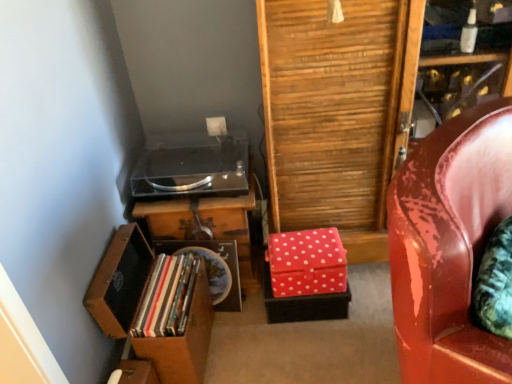
At what (x,y) coordinates should I click in order to perform the action: click on glossy leather chair at right. Please return your answer as a coordinate pair (x, y). Looking at the image, I should click on (449, 246).

Locate an element on the screen. This screenshot has height=384, width=512. wooden table at center is located at coordinates (208, 226).

In order to face transparent acrylic stereo at center, should I rotate leftwards or rightwards?

You should look left and rotate roughly 8.108 degrees.

What is the approximate height of transparent acrylic stereo at center?

It is 4.45 inches.

Locate an element on the screen. This screenshot has width=512, height=384. wooden chest of drawers at lower left is located at coordinates (119, 281).

Identify the location of red polka dot fabric box at lower right. (307, 262).

What are the coordinates of `matte plastic books at lower left` in the screenshot? It's located at (167, 297).

The height and width of the screenshot is (384, 512). In order to click on glossy leather chair at right in this screenshot , I will do `click(449, 246)`.

Would you say wooden chest of drawers at lower left is inside or outside glossy leather chair at right?

wooden chest of drawers at lower left exists outside the volume of glossy leather chair at right.

Is wooden chest of drawers at lower left thinner than glossy leather chair at right?

Indeed, wooden chest of drawers at lower left has a lesser width compared to glossy leather chair at right.

Considering the points (138, 296) and (502, 117), which point is behind, point (138, 296) or point (502, 117)?

The point (138, 296) is farther.

Can you confirm if wooden chest of drawers at lower left is bigger than glossy leather chair at right?

Incorrect, wooden chest of drawers at lower left is not larger than glossy leather chair at right.

Is matte plastic books at lower left smaller than red polka dot fabric box at lower right?

Indeed, matte plastic books at lower left has a smaller size compared to red polka dot fabric box at lower right.

Is red polka dot fabric box at lower right a part of matte plastic books at lower left?

Actually, red polka dot fabric box at lower right is outside matte plastic books at lower left.

From a real-world perspective, is matte plastic books at lower left on top of red polka dot fabric box at lower right?

Yes, from a real-world perspective, matte plastic books at lower left is above red polka dot fabric box at lower right.

Based on the photo, does matte plastic books at lower left have a greater width compared to red polka dot fabric box at lower right?

Incorrect, the width of matte plastic books at lower left does not surpass that of red polka dot fabric box at lower right.

Is transparent acrylic stereo at center bigger than wooden chest of drawers at lower left?

Actually, transparent acrylic stereo at center might be smaller than wooden chest of drawers at lower left.

Between transparent acrylic stereo at center and wooden chest of drawers at lower left, which one has more height?

Standing taller between the two is wooden chest of drawers at lower left.

Is transparent acrylic stereo at center not near wooden chest of drawers at lower left?

No.

Can you tell me how much transparent acrylic stereo at center and wooden chest of drawers at lower left differ in facing direction?

They differ by 91.6 degrees in their facing directions.

Considering the relative sizes of red polka dot fabric box at lower right and glossy leather chair at right in the image provided, is red polka dot fabric box at lower right taller than glossy leather chair at right?

No, red polka dot fabric box at lower right is not taller than glossy leather chair at right.

Is red polka dot fabric box at lower right positioned beyond the bounds of glossy leather chair at right?

That's correct, red polka dot fabric box at lower right is outside of glossy leather chair at right.

Is red polka dot fabric box at lower right positioned with its back to glossy leather chair at right?

No, red polka dot fabric box at lower right's orientation is not away from glossy leather chair at right.

Could you tell me if glossy leather chair at right is turned towards wooden table at center?

No, glossy leather chair at right is not aimed at wooden table at center.

Can you confirm if glossy leather chair at right is wider than wooden table at center?

Yes, glossy leather chair at right is wider than wooden table at center.

Considering the relative positions of glossy leather chair at right and wooden table at center in the image provided, is glossy leather chair at right to the left or to the right of wooden table at center?

glossy leather chair at right is to the right of wooden table at center.

Which is closer, [193,214] or [243,163]?

The point [193,214] is in front.

From a real-world perspective, who is located lower, wooden table at center or transparent acrylic stereo at center?

wooden table at center.

Is wooden table at center positioned far away from transparent acrylic stereo at center?

No, wooden table at center is in close proximity to transparent acrylic stereo at center.

Considering the positions of objects wooden table at center and transparent acrylic stereo at center in the image provided, who is more to the left, wooden table at center or transparent acrylic stereo at center?

Positioned to the left is transparent acrylic stereo at center.

Based on their sizes in the image, would you say wooden table at center is bigger or smaller than wooden chest of drawers at lower left?

wooden table at center is smaller than wooden chest of drawers at lower left.

Considering their positions, is wooden table at center located in front of or behind wooden chest of drawers at lower left?

In the image, wooden table at center appears behind wooden chest of drawers at lower left.

How different are the orientations of wooden table at center and wooden chest of drawers at lower left in degrees?

They differ by 89.7 degrees in their facing directions.

Where is `chair lying above the wooden chest of drawers at lower left (from the image's perspective)`? The height and width of the screenshot is (384, 512). chair lying above the wooden chest of drawers at lower left (from the image's perspective) is located at coordinates (449, 246).

Locate an element on the screen. Image resolution: width=512 pixels, height=384 pixels. box behind the matte plastic books at lower left is located at coordinates (307, 262).

When comparing their distances from glossy leather chair at right, does wooden chest of drawers at lower left or transparent acrylic stereo at center seem further?

Based on the image, transparent acrylic stereo at center appears to be further to glossy leather chair at right.

Which object lies nearer to the anchor point matte plastic books at lower left, transparent acrylic stereo at center or wooden table at center?

Among the two, wooden table at center is located nearer to matte plastic books at lower left.

When comparing their distances from matte plastic books at lower left, does red polka dot fabric box at lower right or wooden table at center seem further?

red polka dot fabric box at lower right is positioned further to the anchor matte plastic books at lower left.

Based on their spatial positions, is red polka dot fabric box at lower right or transparent acrylic stereo at center closer to wooden chest of drawers at lower left?

transparent acrylic stereo at center lies closer to wooden chest of drawers at lower left than the other object.

Based on the photo, looking at the image, which one is located closer to matte plastic books at lower left, glossy leather chair at right or wooden chest of drawers at lower left?

Among the two, wooden chest of drawers at lower left is located nearer to matte plastic books at lower left.

Which object lies further to the anchor point transparent acrylic stereo at center, wooden table at center or glossy leather chair at right?

Among the two, glossy leather chair at right is located further to transparent acrylic stereo at center.

Based on their spatial positions, is red polka dot fabric box at lower right or wooden table at center further from transparent acrylic stereo at center?

Among the two, red polka dot fabric box at lower right is located further to transparent acrylic stereo at center.

Looking at the image, which one is located closer to wooden table at center, matte plastic books at lower left or glossy leather chair at right?

Based on the image, matte plastic books at lower left appears to be nearer to wooden table at center.

I want to click on book located between wooden chest of drawers at lower left and glossy leather chair at right in the left-right direction, so click(x=167, y=297).

Where is `stereo between wooden chest of drawers at lower left and red polka dot fabric box at lower right in the horizontal direction`? The height and width of the screenshot is (384, 512). stereo between wooden chest of drawers at lower left and red polka dot fabric box at lower right in the horizontal direction is located at coordinates (190, 166).

You are a GUI agent. You are given a task and a screenshot of the screen. Output one action in this format:
    pyautogui.click(x=<x>, y=<y>)
    Task: Click on the box between wooden chest of drawers at lower left and glossy leather chair at right
    
    Given the screenshot: What is the action you would take?
    pyautogui.click(x=307, y=262)

Where is `book between transparent acrylic stereo at center and wooden chest of drawers at lower left in the up-down direction`? book between transparent acrylic stereo at center and wooden chest of drawers at lower left in the up-down direction is located at coordinates (167, 297).